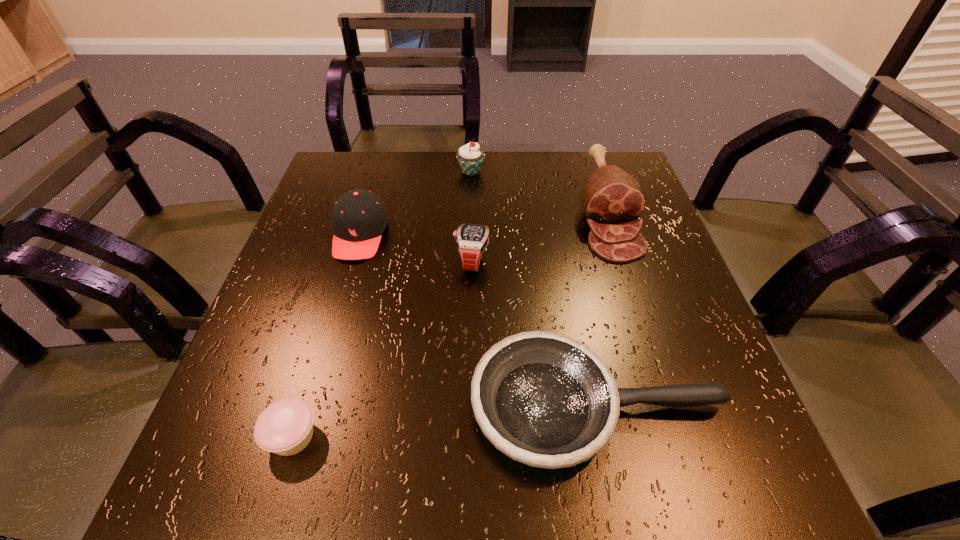
Where is `free spot located on the front-facing side of the cap`? The image size is (960, 540). free spot located on the front-facing side of the cap is located at coordinates (309, 408).

At what (x,y) coordinates should I click in order to perform the action: click on vacant space positioned 0.120m on the right of the watch. Please return your answer as a coordinate pair (x, y). Looking at the image, I should click on (544, 261).

Find the location of a particular element. vacant point located on the right of the left cupcake is located at coordinates (519, 436).

The image size is (960, 540). I want to click on ham that is at the far edge, so click(613, 201).

Locate an element on the screen. cupcake located at the far edge is located at coordinates (470, 158).

Identify the location of frying pan at the near edge. (544, 399).

Identify the location of cupcake at the near edge. The width and height of the screenshot is (960, 540). (285, 427).

This screenshot has width=960, height=540. Identify the location of cap located in the left edge section of the desktop. (359, 218).

This screenshot has height=540, width=960. Identify the location of cupcake that is at the left edge. (285, 427).

Where is `ham that is at the right edge`? ham that is at the right edge is located at coordinates (613, 201).